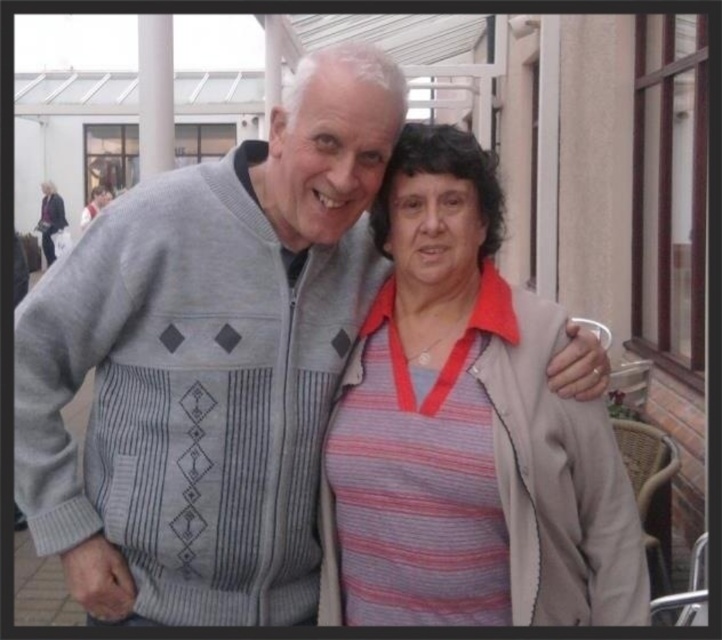
Who is positioned more to the left, striped fabric sweater at upper left or striped fabric sweater at center?

From the viewer's perspective, striped fabric sweater at upper left appears more on the left side.

Is striped fabric sweater at upper left wider than striped fabric sweater at center?

Yes, striped fabric sweater at upper left is wider than striped fabric sweater at center.

Who is more forward, (45, 180) or (79, 220)?

Point (79, 220)

Locate an element on the screen. This screenshot has width=722, height=640. striped fabric sweater at upper left is located at coordinates (51, 220).

Who is more forward, (482, 600) or (87, 202)?

Positioned in front is point (482, 600).

Is striped fabric shirt at center to the left of striped fabric sweater at center from the viewer's perspective?

In fact, striped fabric shirt at center is to the right of striped fabric sweater at center.

Who is more forward, (391, 333) or (82, 212)?

Positioned in front is point (391, 333).

Locate an element on the screen. The image size is (722, 640). striped fabric shirt at center is located at coordinates (466, 432).

Does striped fabric shirt at center have a greater width compared to striped fabric sweater at upper left?

Yes.

Is striped fabric shirt at center to the right of striped fabric sweater at upper left from the viewer's perspective?

Correct, you'll find striped fabric shirt at center to the right of striped fabric sweater at upper left.

The width and height of the screenshot is (722, 640). What are the coordinates of `striped fabric shirt at center` in the screenshot? It's located at (x=466, y=432).